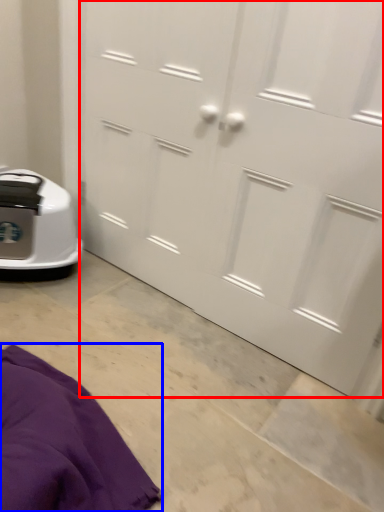
Question: Which object appears closest to the camera in this image, door (highlighted by a red box) or blanket (highlighted by a blue box)?

Choices:
 (A) door
 (B) blanket

Answer: (B)